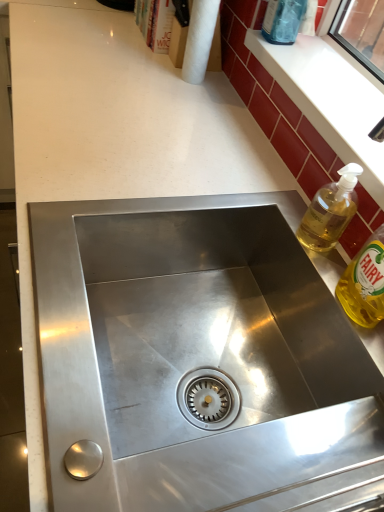
Where is `translucent yellow liquid at upper right, the second bottle when ordered from top to bottom`? Image resolution: width=384 pixels, height=512 pixels. translucent yellow liquid at upper right, the second bottle when ordered from top to bottom is located at coordinates (330, 211).

Measure the distance between point [296,29] and camera.

1.06 meters.

The image size is (384, 512). In order to click on white paper towel at upper center in this screenshot , I will do (x=202, y=41).

In order to face yellow translucent liquid at right, the first bottle in the bottom-to-top sequence, should I rotate leftwards or rightwards?

To align with it, rotate right about 25.129°.

Find the location of a particular element. The image size is (384, 512). white glossy window sill at upper right is located at coordinates (329, 98).

From the image's perspective, which is below, translucent yellow liquid at upper right, which is the 2th bottle from bottom to top, or white glossy window sill at upper right?

translucent yellow liquid at upper right, which is the 2th bottle from bottom to top, from the image's perspective.

From a real-world perspective, relative to white glossy window sill at upper right, is translucent yellow liquid at upper right, which is the 2th bottle from bottom to top, vertically above or below?

translucent yellow liquid at upper right, which is the 2th bottle from bottom to top, is situated lower than white glossy window sill at upper right in the real world.

Is translucent yellow liquid at upper right, the second bottle when ordered from top to bottom, closer to the viewer compared to white glossy window sill at upper right?

Yes, translucent yellow liquid at upper right, the second bottle when ordered from top to bottom, is closer to the camera.

How many degrees apart are the facing directions of translucent yellow liquid at upper right, the 2th bottle when ordered from back to front, and white glossy window sill at upper right?

The angular difference between translucent yellow liquid at upper right, the 2th bottle when ordered from back to front, and white glossy window sill at upper right is 1.7 degrees.

Can you tell me how much translucent yellow liquid at upper right, the 2th bottle when ordered from back to front, and transparent glass bottle at upper right, positioned as the first bottle in back-to-front order, differ in facing direction?

1.71 degrees.

Can you confirm if translucent yellow liquid at upper right, the second bottle when ordered from top to bottom, is shorter than transparent glass bottle at upper right, positioned as the first bottle in back-to-front order?

Yes, translucent yellow liquid at upper right, the second bottle when ordered from top to bottom, is shorter than transparent glass bottle at upper right, positioned as the first bottle in back-to-front order.

Is transparent glass bottle at upper right, the 3th bottle in the bottom-to-top sequence, a part of translucent yellow liquid at upper right, which is the 2th bottle in front-to-back order?

No.

Is translucent yellow liquid at upper right, the second bottle when ordered from top to bottom, oriented towards transparent glass bottle at upper right, positioned as the first bottle in back-to-front order?

No, translucent yellow liquid at upper right, the second bottle when ordered from top to bottom, is not oriented towards transparent glass bottle at upper right, positioned as the first bottle in back-to-front order.

Is yellow translucent liquid at right, the first bottle in the bottom-to-top sequence, looking in the opposite direction of white glossy window sill at upper right?

yellow translucent liquid at right, the first bottle in the bottom-to-top sequence, does not have its back to white glossy window sill at upper right.

Which is closer to the camera, (364, 296) or (365, 174)?

Point (364, 296)

Find the location of a particular element. The height and width of the screenshot is (512, 384). bottle that is the 1st object directly below the white glossy window sill at upper right (from a real-world perspective) is located at coordinates (365, 283).

Based on the photo, from a real-world perspective, which object stands above the other?

white glossy window sill at upper right is physically above.

Is white paper towel at upper center directly adjacent to yellow translucent liquid at right, the 3th bottle positioned from the back?

No, white paper towel at upper center is not in contact with yellow translucent liquid at right, the 3th bottle positioned from the back.

You are a GUI agent. You are given a task and a screenshot of the screen. Output one action in this format:
    pyautogui.click(x=<x>, y=<y>)
    Task: Click on the paper towel on the left side of yellow translucent liquid at right, the first bottle in the bottom-to-top sequence
    
    Given the screenshot: What is the action you would take?
    pyautogui.click(x=202, y=41)

Does white paper towel at upper center have a lesser height compared to yellow translucent liquid at right, the 1th bottle viewed from the front?

No, white paper towel at upper center is not shorter than yellow translucent liquid at right, the 1th bottle viewed from the front.

Based on the photo, from a real-world perspective, who is located lower, white paper towel at upper center or yellow translucent liquid at right, the first bottle in the bottom-to-top sequence?

Result: In real-world perspective, yellow translucent liquid at right, the first bottle in the bottom-to-top sequence, is lower.

Which object is wider, white glossy window sill at upper right or translucent yellow liquid at upper right, the 2th bottle when ordered from back to front?

white glossy window sill at upper right is wider.

From a real-world perspective, which object stands above the other?

In real-world perspective, white glossy window sill at upper right is above.

Where is `bottle above the white glossy window sill at upper right (from a real-world perspective)`? bottle above the white glossy window sill at upper right (from a real-world perspective) is located at coordinates (283, 20).

From a real-world perspective, is transparent glass bottle at upper right, the 1th bottle when ordered from top to bottom, above or below white glossy window sill at upper right?

Clearly, from a real-world perspective, transparent glass bottle at upper right, the 1th bottle when ordered from top to bottom, is above white glossy window sill at upper right.

Can you confirm if transparent glass bottle at upper right, the 3th bottle in the bottom-to-top sequence, is taller than white glossy window sill at upper right?

Indeed, transparent glass bottle at upper right, the 3th bottle in the bottom-to-top sequence, has a greater height compared to white glossy window sill at upper right.

How many degrees apart are the facing directions of transparent glass bottle at upper right, the 1th bottle when ordered from top to bottom, and white glossy window sill at upper right?

0.00649 degrees separate the facing orientations of transparent glass bottle at upper right, the 1th bottle when ordered from top to bottom, and white glossy window sill at upper right.

Which point is more distant from viewer, (383, 248) or (214, 54)?

Positioned behind is point (214, 54).

From their relative heights in the image, would you say yellow translucent liquid at right, the 3th bottle positioned from the back, is taller or shorter than white paper towel at upper center?

Clearly, yellow translucent liquid at right, the 3th bottle positioned from the back, is shorter compared to white paper towel at upper center.

Who is bigger, yellow translucent liquid at right, the 1th bottle viewed from the front, or white paper towel at upper center?

yellow translucent liquid at right, the 1th bottle viewed from the front.

From the image's perspective, which bottle is the 1st one below the white glossy window sill at upper right? Please provide its 2D coordinates.

[(330, 211)]

From a real-world perspective, count 2nd bottles upward from the translucent yellow liquid at upper right, which is the 2th bottle from bottom to top, and point to it. Please provide its 2D coordinates.

[(283, 20)]

Looking at the image, which one is located further to white glossy window sill at upper right, translucent yellow liquid at upper right, the second bottle when ordered from top to bottom, or white paper towel at upper center?

white paper towel at upper center.

Estimate the real-world distances between objects in this image. Which object is further from translucent yellow liquid at upper right, the second bottle when ordered from top to bottom, transparent glass bottle at upper right, positioned as the first bottle in back-to-front order, or white paper towel at upper center?

Based on the image, white paper towel at upper center appears to be further to translucent yellow liquid at upper right, the second bottle when ordered from top to bottom.

Which object lies nearer to the anchor point transparent glass bottle at upper right, the third bottle in the front-to-back sequence, white paper towel at upper center or yellow translucent liquid at right, the 3th bottle positioned from the back?

white paper towel at upper center.

From the image, which object appears to be nearer to yellow translucent liquid at right, the first bottle in the bottom-to-top sequence, translucent yellow liquid at upper right, the 2th bottle when ordered from back to front, or white glossy window sill at upper right?

Among the two, translucent yellow liquid at upper right, the 2th bottle when ordered from back to front, is located nearer to yellow translucent liquid at right, the first bottle in the bottom-to-top sequence.

Based on their spatial positions, is translucent yellow liquid at upper right, which is the 2th bottle in front-to-back order, or yellow translucent liquid at right, the first bottle in the bottom-to-top sequence, closer to white paper towel at upper center?

translucent yellow liquid at upper right, which is the 2th bottle in front-to-back order, is closer to white paper towel at upper center.

Based on their spatial positions, is transparent glass bottle at upper right, positioned as the first bottle in back-to-front order, or white paper towel at upper center closer to white glossy window sill at upper right?

transparent glass bottle at upper right, positioned as the first bottle in back-to-front order, is positioned closer to the anchor white glossy window sill at upper right.

Based on their spatial positions, is translucent yellow liquid at upper right, which is the 2th bottle in front-to-back order, or transparent glass bottle at upper right, the 3th bottle in the bottom-to-top sequence, further from white paper towel at upper center?

translucent yellow liquid at upper right, which is the 2th bottle in front-to-back order, is further to white paper towel at upper center.

Considering their positions, is white paper towel at upper center positioned further to transparent glass bottle at upper right, the 3th bottle in the bottom-to-top sequence, than translucent yellow liquid at upper right, which is the 2th bottle in front-to-back order?

translucent yellow liquid at upper right, which is the 2th bottle in front-to-back order, is further to transparent glass bottle at upper right, the 3th bottle in the bottom-to-top sequence.

Identify the location of paper towel that lies between transparent glass bottle at upper right, the third bottle in the front-to-back sequence, and white glossy window sill at upper right from top to bottom. (202, 41).

Locate an element on the screen. bottle between white paper towel at upper center and yellow translucent liquid at right, the first bottle in the bottom-to-top sequence, in the vertical direction is located at coordinates tap(330, 211).

The height and width of the screenshot is (512, 384). What are the coordinates of `bottle between white glossy window sill at upper right and yellow translucent liquid at right, the first bottle in the bottom-to-top sequence, from top to bottom` in the screenshot? It's located at 330,211.

This screenshot has height=512, width=384. I want to click on paper towel that lies between transparent glass bottle at upper right, the 3th bottle in the bottom-to-top sequence, and yellow translucent liquid at right, the first bottle in the bottom-to-top sequence, from top to bottom, so click(x=202, y=41).